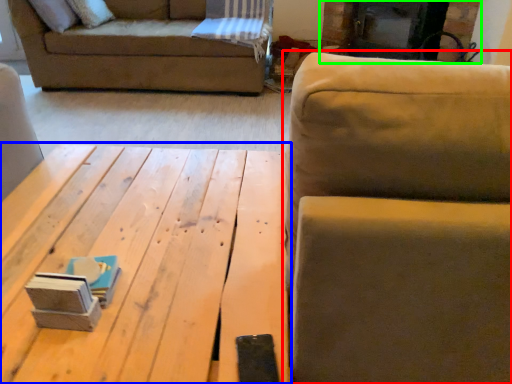
Question: Considering the real-world distances, which object is farthest from studio couch (highlighted by a red box)? table (highlighted by a blue box) or fireplace (highlighted by a green box)?

Choices:
 (A) table
 (B) fireplace

Answer: (B)